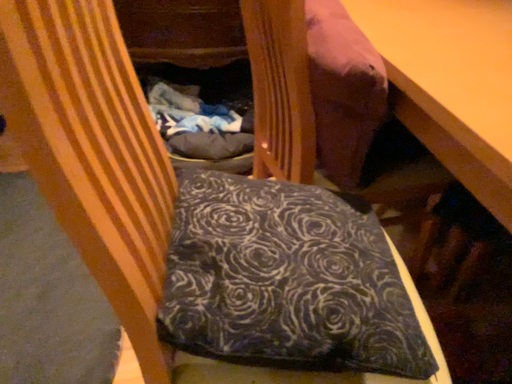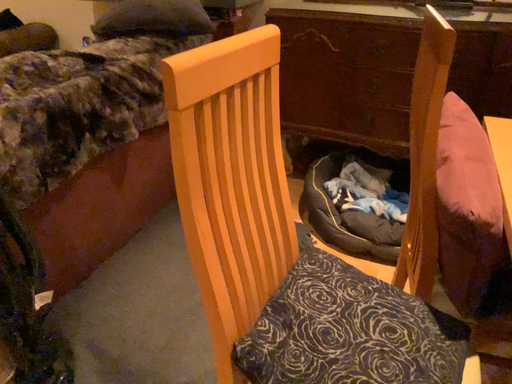
Question: How did the camera likely rotate when shooting the video?

Choices:
 (A) rotated downward
 (B) rotated upward

Answer: (B)